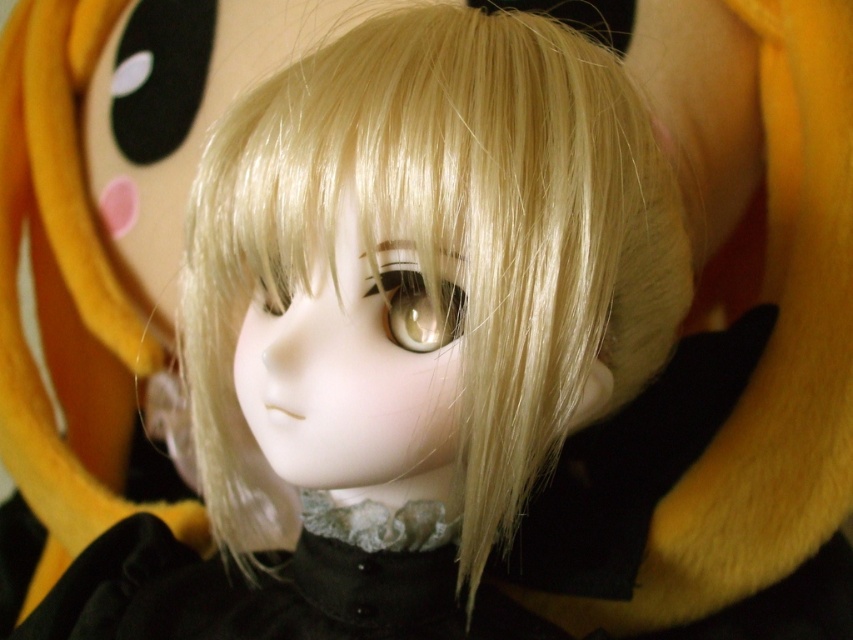
Question: Which object appears closest to the camera in this image?

Choices:
 (A) blonde silky hair at center
 (B) soft yellow plush at upper left

Answer: (A)

Question: Is blonde silky hair at center above soft yellow plush at upper left?

Choices:
 (A) no
 (B) yes

Answer: (A)

Question: Which of the following is the closest to the observer?

Choices:
 (A) soft yellow plush at upper left
 (B) blonde silky hair at center

Answer: (B)

Question: Observing the image, what is the correct spatial positioning of blonde silky hair at center in reference to soft yellow plush at upper left?

Choices:
 (A) below
 (B) above

Answer: (A)

Question: Which point is closer to the camera?

Choices:
 (A) (274, 296)
 (B) (100, 240)

Answer: (A)

Question: Does blonde silky hair at center appear on the right side of soft yellow plush at upper left?

Choices:
 (A) yes
 (B) no

Answer: (A)